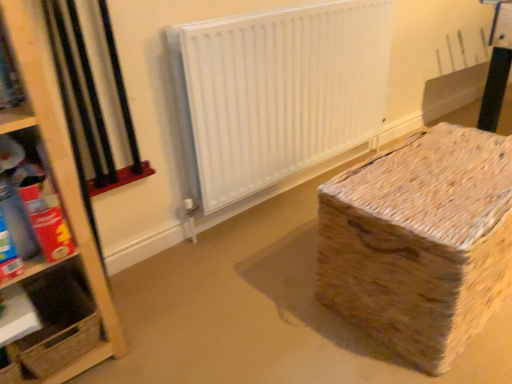
Question: Is white matte radiator at center taller than wooden at left, which ranks as the first shelf in bottom-to-top order?

Choices:
 (A) yes
 (B) no

Answer: (A)

Question: Does white matte radiator at center have a lesser height compared to wooden at left, the second shelf from the top?

Choices:
 (A) no
 (B) yes

Answer: (A)

Question: Would you say white matte radiator at center is outside wooden at left, the second shelf from the top?

Choices:
 (A) yes
 (B) no

Answer: (A)

Question: Can you see white matte radiator at center touching wooden at left, the second shelf from the top?

Choices:
 (A) yes
 (B) no

Answer: (B)

Question: Can you confirm if white matte radiator at center is wider than wooden at left, the second shelf from the top?

Choices:
 (A) yes
 (B) no

Answer: (B)

Question: From a real-world perspective, is cardboard box at left, the 2th shelf from the bottom, physically located above or below wooden at left, which ranks as the first shelf in bottom-to-top order?

Choices:
 (A) below
 (B) above

Answer: (B)

Question: From the image's perspective, is cardboard box at left, the 2th shelf from the bottom, above or below wooden at left, which ranks as the first shelf in bottom-to-top order?

Choices:
 (A) above
 (B) below

Answer: (A)

Question: In terms of height, does cardboard box at left, the 2th shelf from the bottom, look taller or shorter compared to wooden at left, the second shelf from the top?

Choices:
 (A) short
 (B) tall

Answer: (B)

Question: Based on their positions, is cardboard box at left, which is counted as the 1th shelf, starting from the top, located to the left or right of wooden at left, which ranks as the first shelf in bottom-to-top order?

Choices:
 (A) right
 (B) left

Answer: (A)

Question: Is point (58, 322) closer or farther from the camera than point (485, 175)?

Choices:
 (A) closer
 (B) farther

Answer: (A)

Question: From a real-world perspective, is wooden at left, which ranks as the first shelf in bottom-to-top order, physically located above or below woven cardboard box at lower right?

Choices:
 (A) below
 (B) above

Answer: (A)

Question: In terms of width, does wooden at left, which ranks as the first shelf in bottom-to-top order, look wider or thinner when compared to woven cardboard box at lower right?

Choices:
 (A) wide
 (B) thin

Answer: (B)

Question: Considering the positions of wooden at left, the second shelf from the top, and woven cardboard box at lower right in the image, is wooden at left, the second shelf from the top, bigger or smaller than woven cardboard box at lower right?

Choices:
 (A) small
 (B) big

Answer: (A)

Question: From the image's perspective, is woven cardboard box at lower right positioned above or below white matte radiator at center?

Choices:
 (A) below
 (B) above

Answer: (A)

Question: Considering the positions of point (433, 258) and point (352, 104), is point (433, 258) closer or farther from the camera than point (352, 104)?

Choices:
 (A) closer
 (B) farther

Answer: (A)